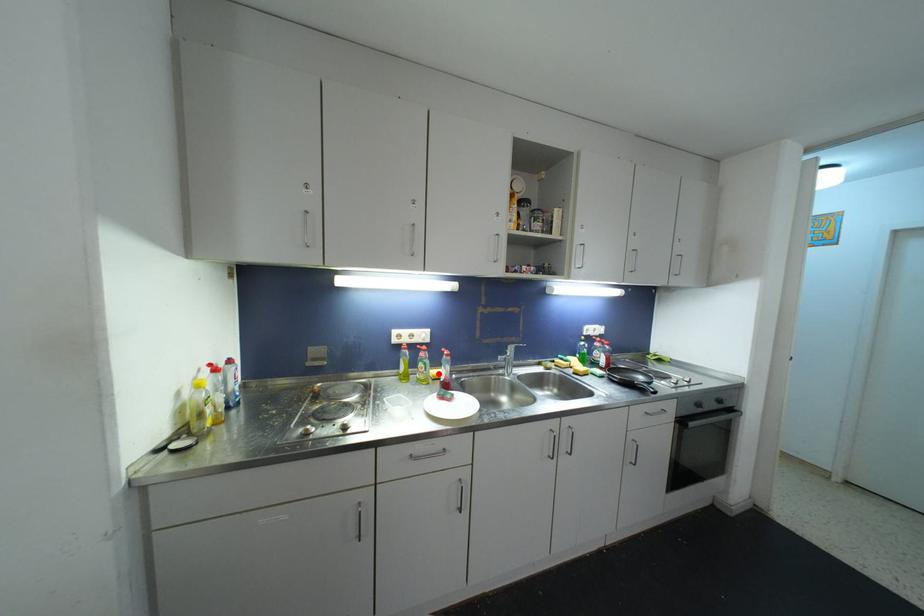
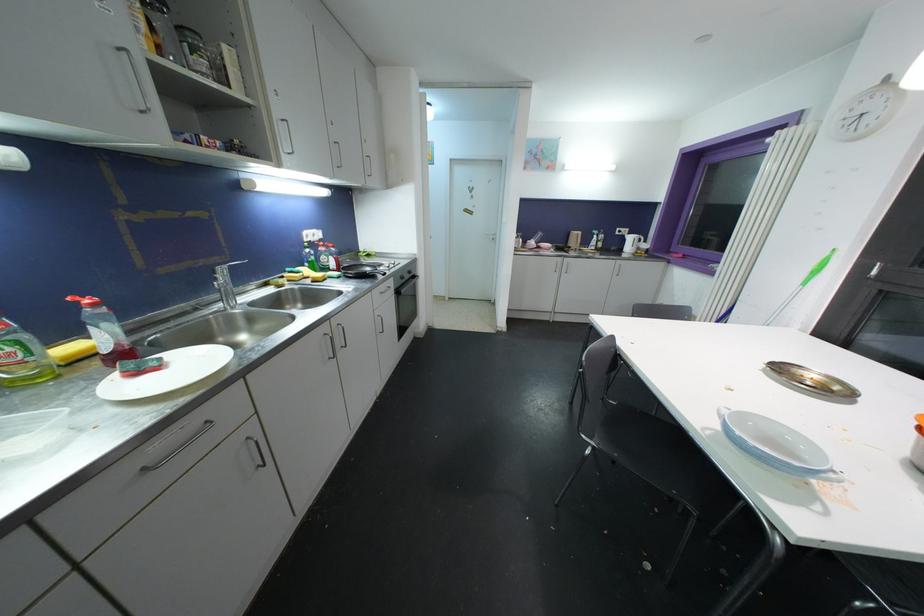
Find the pixel in the second image that matches the highlighted location in the first image.

(69, 350)